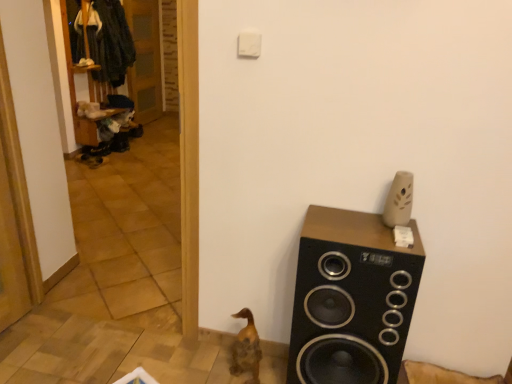
This screenshot has height=384, width=512. In order to click on brown wooden duck at lower center in this screenshot , I will do `click(246, 348)`.

Where is `brown wooden duck at lower center`? Image resolution: width=512 pixels, height=384 pixels. brown wooden duck at lower center is located at coordinates (246, 348).

Can you confirm if black matte speaker at right is wider than wooden at left?

Yes, black matte speaker at right is wider than wooden at left.

Is point (380, 367) more distant than point (154, 49)?

No, (380, 367) is closer to viewer.

Can you confirm if black matte speaker at right is positioned to the left of wooden at left?

In fact, black matte speaker at right is to the right of wooden at left.

Is black matte speaker at right next to wooden at left and touching it?

No, black matte speaker at right is not with wooden at left.

Is point (234, 363) closer or farther from the camera than point (139, 28)?

Point (234, 363) appears to be closer to the viewer than point (139, 28).

From the image's perspective, would you say brown wooden duck at lower center is positioned over wooden at left?

Result: Actually, brown wooden duck at lower center appears below wooden at left in the image.

Which object is closer to the camera taking this photo, brown wooden duck at lower center or wooden at left?

brown wooden duck at lower center.

From the picture: Is brown wooden duck at lower center looking in the opposite direction of black matte speaker at right?

brown wooden duck at lower center does not have its back to black matte speaker at right.

Which of these two, brown wooden duck at lower center or black matte speaker at right, is wider?

Wider between the two is black matte speaker at right.

The image size is (512, 384). Identify the location of animal below the black matte speaker at right (from the image's perspective). (246, 348).

Are brown wooden duck at lower center and black matte speaker at right making contact?

No.

Could you tell me if black matte speaker at right is facing brown wooden duck at lower center?

No, black matte speaker at right is not facing towards brown wooden duck at lower center.

Who is more distant, black matte speaker at right or brown wooden duck at lower center?

brown wooden duck at lower center is more distant.

Is the surface of black matte speaker at right in direct contact with brown wooden duck at lower center?

black matte speaker at right is not next to brown wooden duck at lower center, and they're not touching.

Between black matte speaker at right and brown wooden duck at lower center, which one has larger width?

Wider between the two is black matte speaker at right.

Which object is positioned more to the left, wooden at left or black matte speaker at right?

From the viewer's perspective, wooden at left appears more on the left side.

Is black matte speaker at right inside wooden at left?

No, black matte speaker at right is not surrounded by wooden at left.

From the image's perspective, which one is positioned lower, wooden at left or black matte speaker at right?

black matte speaker at right, from the image's perspective.

Visually, is wooden at left positioned to the left or to the right of brown wooden duck at lower center?

In the image, wooden at left appears on the left side of brown wooden duck at lower center.

Locate an element on the screen. This screenshot has width=512, height=384. door behind the brown wooden duck at lower center is located at coordinates (145, 59).

Can you see wooden at left touching brown wooden duck at lower center?

No, wooden at left is not making contact with brown wooden duck at lower center.

Can brown wooden duck at lower center be found inside wooden at left?

Actually, brown wooden duck at lower center is outside wooden at left.

At what (x,y) coordinates should I click in order to perform the action: click on speaker that appears on the right of wooden at left. Please return your answer as a coordinate pair (x, y). Looking at the image, I should click on (351, 299).

Locate an element on the screen. The image size is (512, 384). door positioned vertically above the brown wooden duck at lower center (from a real-world perspective) is located at coordinates (145, 59).

Looking at the image, which one is located further to brown wooden duck at lower center, black matte speaker at right or wooden at left?

wooden at left is further to brown wooden duck at lower center.

When comparing their distances from black matte speaker at right, does brown wooden duck at lower center or wooden at left seem closer?

brown wooden duck at lower center is closer to black matte speaker at right.

Estimate the real-world distances between objects in this image. Which object is closer to black matte speaker at right, wooden at left or brown wooden duck at lower center?

brown wooden duck at lower center lies closer to black matte speaker at right than the other object.

Considering their positions, is brown wooden duck at lower center positioned closer to wooden at left than black matte speaker at right?

brown wooden duck at lower center lies closer to wooden at left than the other object.

When comparing their distances from wooden at left, does black matte speaker at right or brown wooden duck at lower center seem further?

Based on the image, black matte speaker at right appears to be further to wooden at left.

From the image, which object appears to be nearer to brown wooden duck at lower center, wooden at left or black matte speaker at right?

black matte speaker at right.

Locate an element on the screen. The image size is (512, 384). animal between black matte speaker at right and wooden at left in the front-back direction is located at coordinates (246, 348).